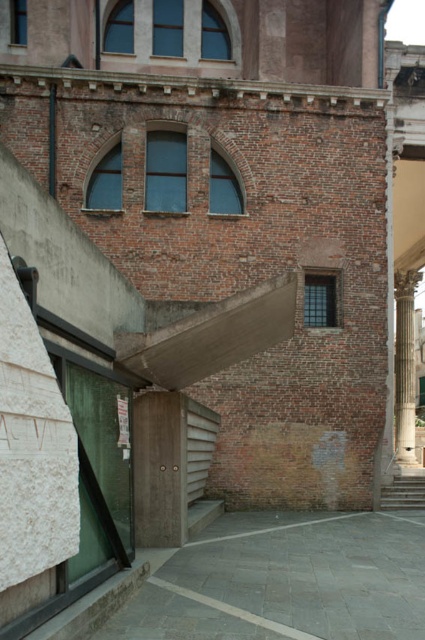
Does white marble column at right have a lesser width compared to wooden stairs at lower right?

In fact, white marble column at right might be wider than wooden stairs at lower right.

Does point (396, 346) lie in front of point (416, 506)?

That is False.

Is point (399, 403) behind point (405, 499)?

Yes, it is behind point (405, 499).

You are a GUI agent. You are given a task and a screenshot of the screen. Output one action in this format:
    pyautogui.click(x=<x>, y=<y>)
    Task: Click on the white marble column at right
    The width and height of the screenshot is (425, 640).
    Given the screenshot: What is the action you would take?
    point(405,365)